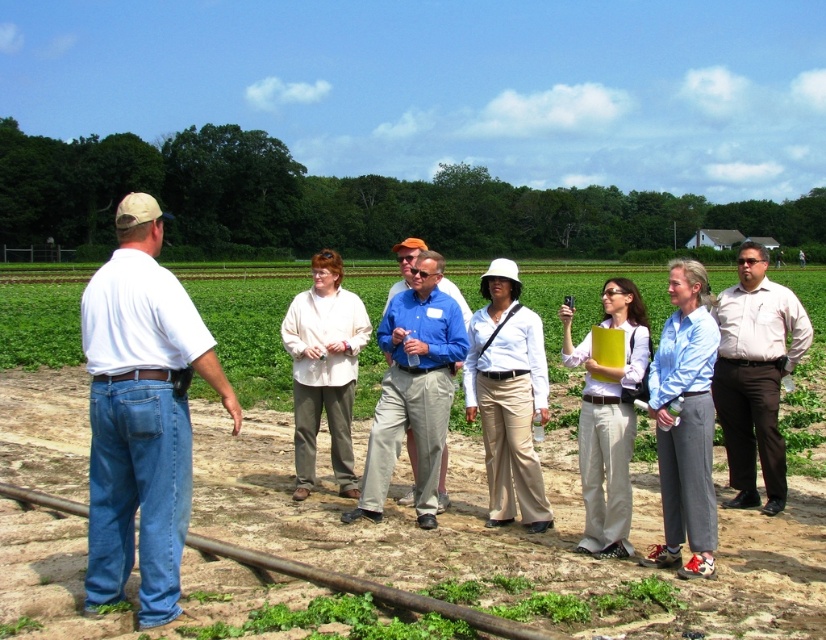
Between point (710, 550) and point (535, 467), which one is positioned behind?

The point (535, 467) is behind.

Who is positioned more to the left, light blue shirt at center or white matte shirt at center?

white matte shirt at center is more to the left.

Is point (658, 476) positioned in front of point (518, 392)?

Yes, point (658, 476) is in front of point (518, 392).

Image resolution: width=826 pixels, height=640 pixels. I want to click on light blue shirt at center, so click(x=686, y=422).

Who is more distant from viewer, (774, 621) or (459, 300)?

Point (459, 300)

What are the coordinates of `brown dirt field at center` in the screenshot? It's located at (510, 541).

Does white cotton shirt at left have a greater height compared to light brown shirt at center?

Indeed, white cotton shirt at left has a greater height compared to light brown shirt at center.

Who is positioned more to the left, white cotton shirt at left or light brown shirt at center?

white cotton shirt at left

Describe the element at coordinates (141, 413) in the screenshot. This screenshot has width=826, height=640. I see `white cotton shirt at left` at that location.

Where is `white cotton shirt at left`? This screenshot has height=640, width=826. white cotton shirt at left is located at coordinates (141, 413).